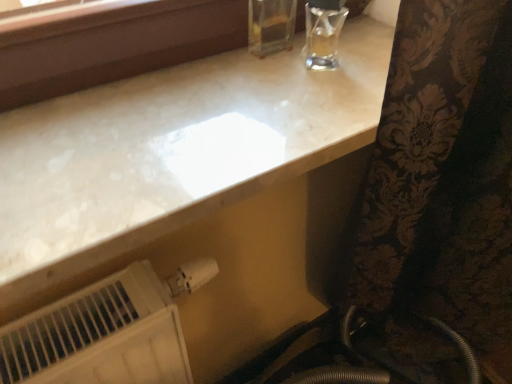
Question: Considering the relative sizes of white marble countertop at upper center and white plastic radiator at lower left in the image provided, is white marble countertop at upper center thinner than white plastic radiator at lower left?

Choices:
 (A) yes
 (B) no

Answer: (B)

Question: From the image's perspective, is white marble countertop at upper center located beneath white plastic radiator at lower left?

Choices:
 (A) no
 (B) yes

Answer: (A)

Question: Is white marble countertop at upper center not within white plastic radiator at lower left?

Choices:
 (A) no
 (B) yes

Answer: (B)

Question: From a real-world perspective, does white marble countertop at upper center stand above white plastic radiator at lower left?

Choices:
 (A) no
 (B) yes

Answer: (B)

Question: From a real-world perspective, is white marble countertop at upper center beneath white plastic radiator at lower left?

Choices:
 (A) no
 (B) yes

Answer: (A)

Question: Does white marble countertop at upper center touch white plastic radiator at lower left?

Choices:
 (A) no
 (B) yes

Answer: (A)

Question: Can you confirm if white plastic radiator at lower left is thinner than white marble countertop at upper center?

Choices:
 (A) yes
 (B) no

Answer: (A)

Question: Considering the relative positions of white plastic radiator at lower left and white marble countertop at upper center in the image provided, is white plastic radiator at lower left to the right of white marble countertop at upper center from the viewer's perspective?

Choices:
 (A) no
 (B) yes

Answer: (A)

Question: Is white marble countertop at upper center inside white plastic radiator at lower left?

Choices:
 (A) no
 (B) yes

Answer: (A)

Question: From the image's perspective, is white plastic radiator at lower left located above white marble countertop at upper center?

Choices:
 (A) yes
 (B) no

Answer: (B)

Question: Is white plastic radiator at lower left oriented towards white marble countertop at upper center?

Choices:
 (A) yes
 (B) no

Answer: (B)

Question: From a real-world perspective, does white plastic radiator at lower left sit lower than white marble countertop at upper center?

Choices:
 (A) yes
 (B) no

Answer: (A)

Question: Looking at the image, does white marble countertop at upper center seem bigger or smaller compared to white plastic radiator at lower left?

Choices:
 (A) big
 (B) small

Answer: (B)